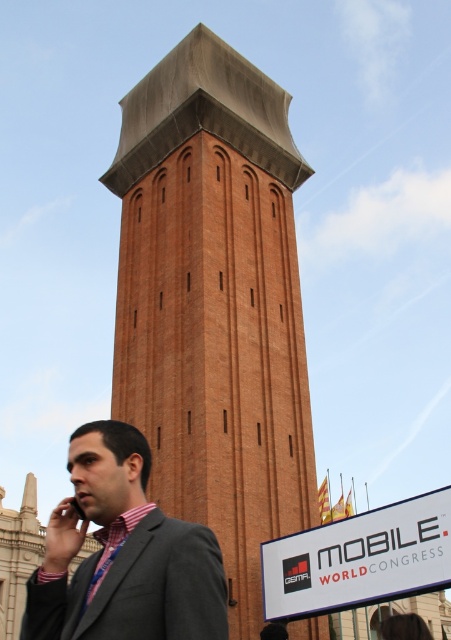
You are standing in front of the brown brick tower at center. A friend tells you that there is a point marked at coordinates (x=215, y=305) on the image. Where is this point located?

The point at coordinates (x=215, y=305) corresponds to the brown brick tower at center.

You are an architect analyzing the proportions of the scene. Given that the gray suit at center is 1.8 meters tall, can you estimate the approximate height of the brown brick tower at center?

The brown brick tower at center has a larger size compared to gray suit at center, which is 1.8 meters tall. Therefore, the tower is taller than 1.8 meters.

You are a photographer standing in front of the brown brick tower at center and the gray suit at center. You want to capture a photo where both subjects are visible. Which subject should you focus on to ensure both are in frame without needing to adjust your camera angle?

The brown brick tower at center is taller than the gray suit at center, so focusing on the tower will ensure both are in frame since the tower occupies more vertical space.